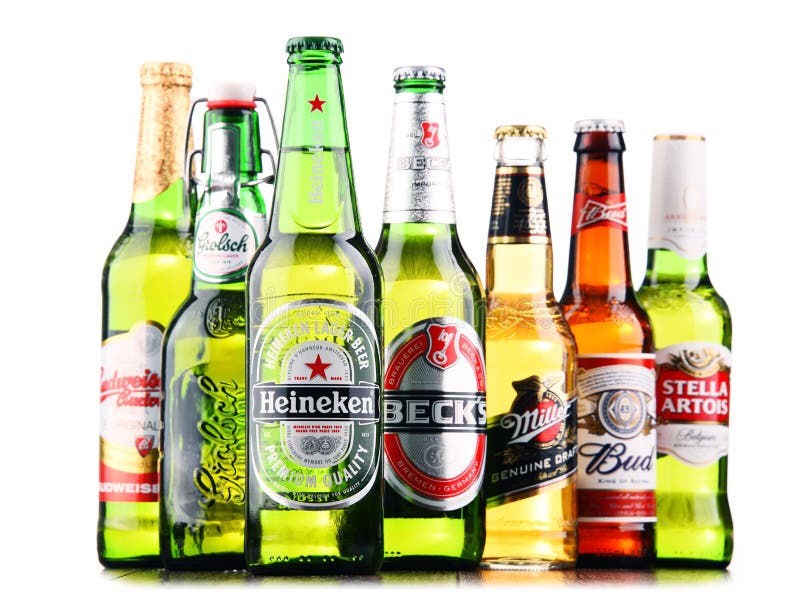
Where is `green glass bottles`? The height and width of the screenshot is (598, 800). green glass bottles is located at coordinates (702, 318), (440, 286), (324, 277), (230, 316), (166, 294).